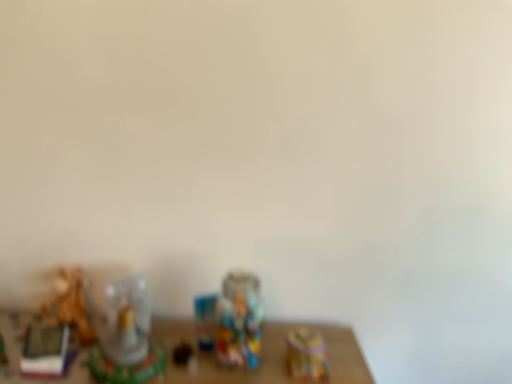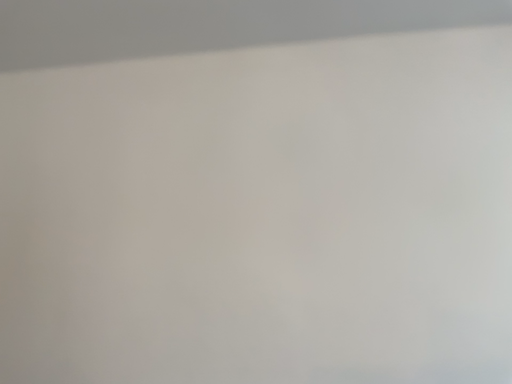
Question: How did the camera likely rotate when shooting the video?

Choices:
 (A) rotated left
 (B) rotated right

Answer: (A)